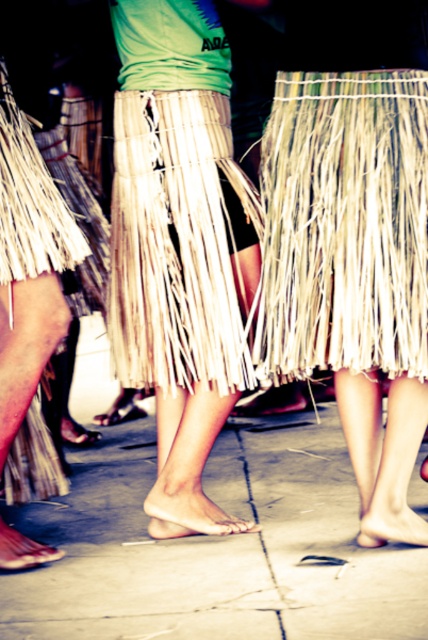
You are a photographer setting up a shoot at the event. You need to place a 1.2 meter wide equipment box on the floor. Given that the concrete at center and the natural fiber skirt at center are present, which area should you choose to ensure the box fits without overlapping the skirt?

The concrete at center has a larger width than the natural fiber skirt at center, so placing the 1.2 meter wide equipment box on the concrete at center would ensure it fits without overlapping the skirt.